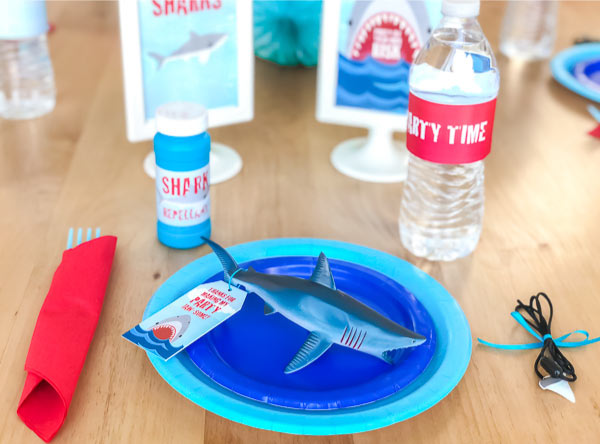
You are a GUI agent. You are given a task and a screenshot of the screen. Output one action in this format:
    pyautogui.click(x=<x>, y=<y>)
    Task: Click on the red napkin
    This screenshot has height=444, width=600.
    Given the screenshot: What is the action you would take?
    pyautogui.click(x=71, y=337), pyautogui.click(x=299, y=100)